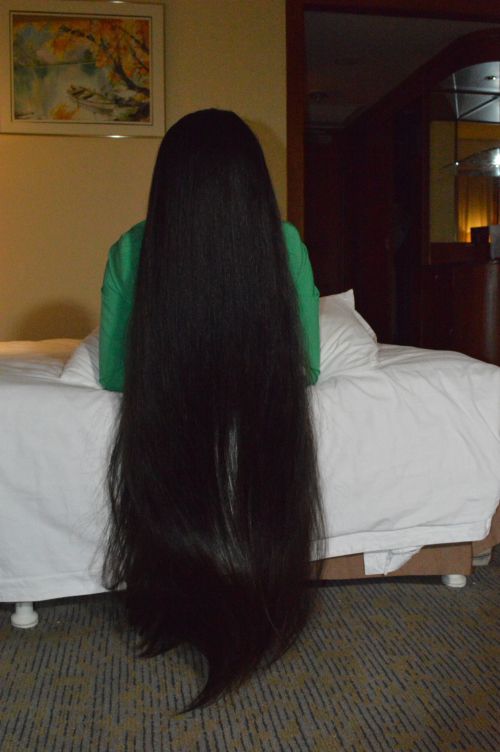
What are the coordinates of `picture frame` in the screenshot? It's located at (165, 88).